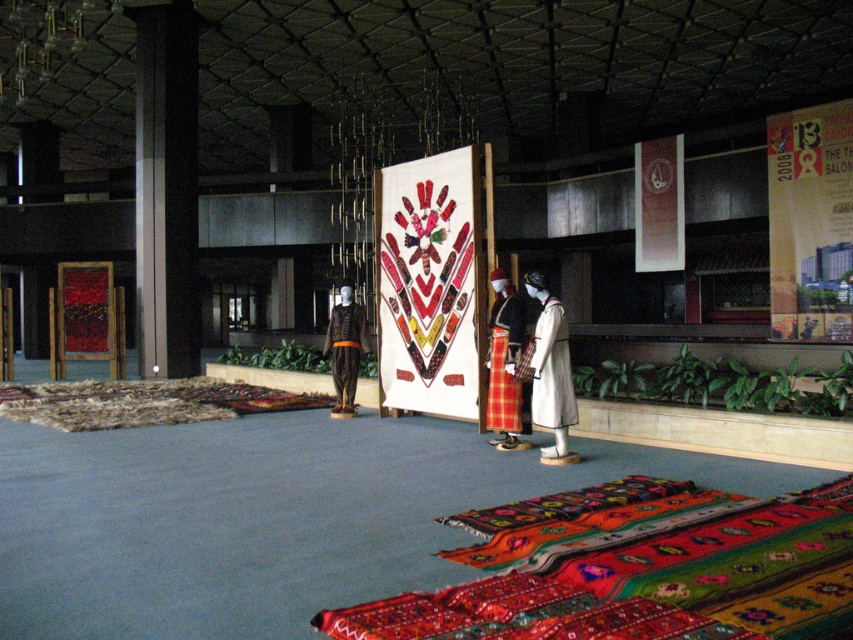
How distant is multicolored woven rug at center from white matte robe at center?

multicolored woven rug at center is 4.76 meters from white matte robe at center.

What do you see at coordinates (143, 403) in the screenshot?
I see `multicolored woven rug at center` at bounding box center [143, 403].

You are a GUI agent. You are given a task and a screenshot of the screen. Output one action in this format:
    pyautogui.click(x=<x>, y=<y>)
    Task: Click on the multicolored woven rug at center
    The width and height of the screenshot is (853, 640).
    Given the screenshot: What is the action you would take?
    pyautogui.click(x=143, y=403)

Does vibrant woven rug at lower center appear on the right side of plaid fabric robe at center?

Correct, you'll find vibrant woven rug at lower center to the right of plaid fabric robe at center.

Which is above, vibrant woven rug at lower center or plaid fabric robe at center?

Positioned higher is plaid fabric robe at center.

The image size is (853, 640). Describe the element at coordinates (642, 576) in the screenshot. I see `vibrant woven rug at lower center` at that location.

At what (x,y) coordinates should I click in order to perform the action: click on vibrant woven rug at lower center. Please return your answer as a coordinate pair (x, y). Image resolution: width=853 pixels, height=640 pixels. Looking at the image, I should click on (642, 576).

Describe the element at coordinates (552, 369) in the screenshot. The image size is (853, 640). I see `white matte robe at center` at that location.

Is white matte robe at center wider than matte black robe at center?

Incorrect, white matte robe at center's width does not surpass matte black robe at center's.

Is point (544, 426) less distant than point (339, 358)?

Yes, point (544, 426) is closer to viewer.

Locate an element on the screen. The height and width of the screenshot is (640, 853). white matte robe at center is located at coordinates (552, 369).